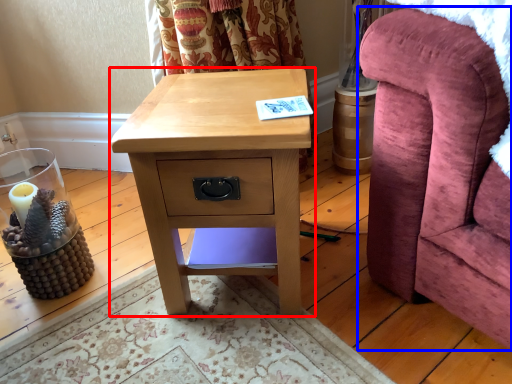
Question: Which object appears farthest to the camera in this image, nightstand (highlighted by a red box) or furniture (highlighted by a blue box)?

Choices:
 (A) nightstand
 (B) furniture

Answer: (A)